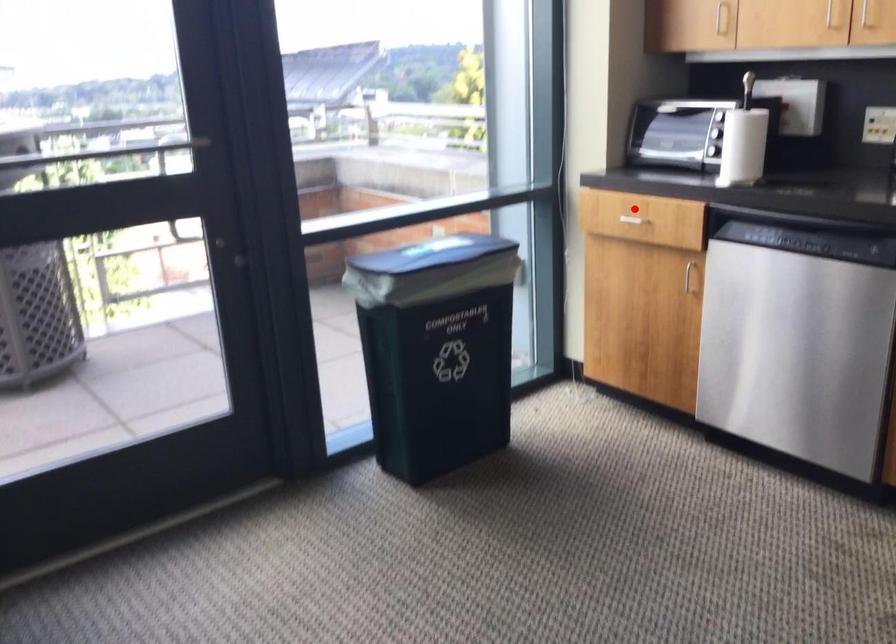
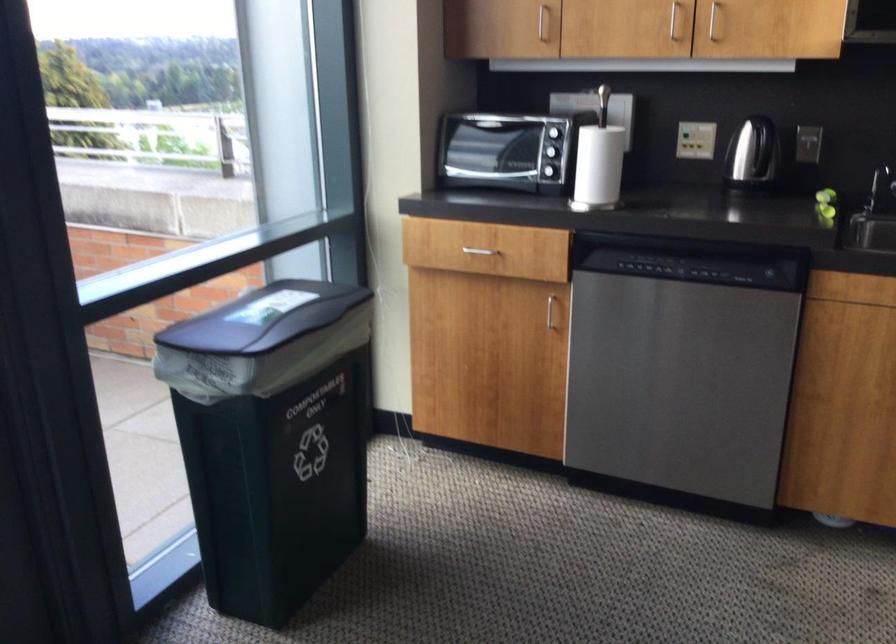
Question: I am providing you with two images of the same scene from different viewpoints. Given a red point in image1, look at the same physical point in image2. Is it:

Choices:
 (A) Closer to the viewpoint
 (B) Farther from the viewpoint

Answer: (A)